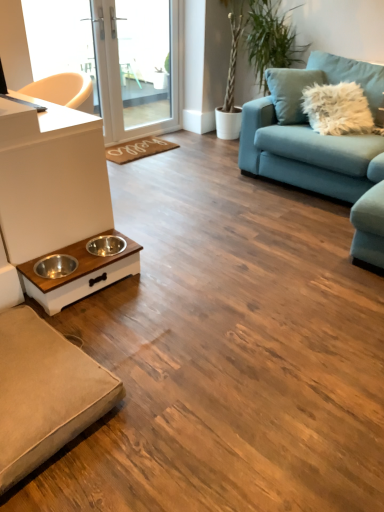
Identify the location of empty space that is ontop of brown woven mat at center (from a real-world perspective). point(152,142).